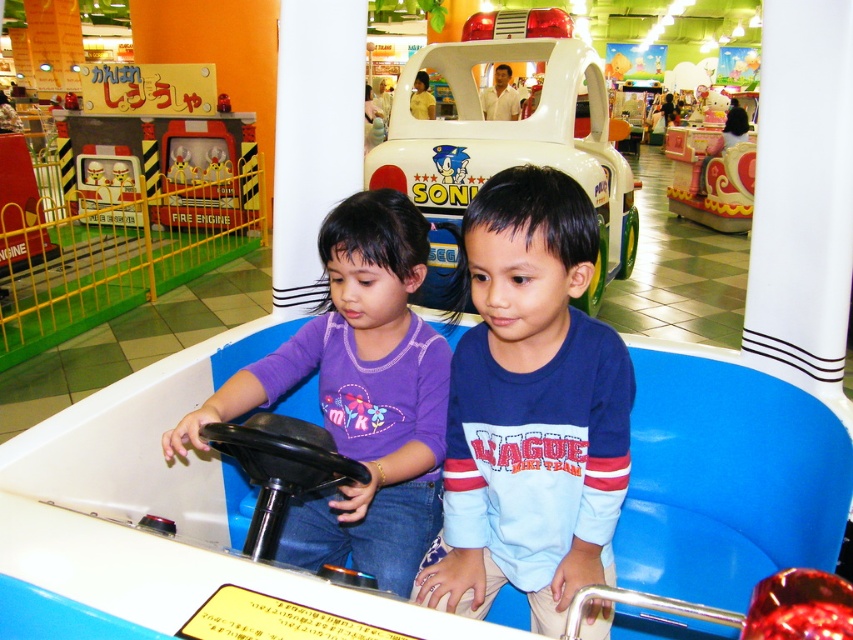
Question: Is metallic fire engine at upper left to the left of metallic yellow fire engine at left from the viewer's perspective?

Choices:
 (A) no
 (B) yes

Answer: (B)

Question: Among these objects, which one is nearest to the camera?

Choices:
 (A) purple matte shirt at center
 (B) metallic yellow fire engine at left

Answer: (A)

Question: Considering the real-world distances, which object is farthest from the metallic silver fire engine at center?

Choices:
 (A) white plastic toy car at center
 (B) metallic yellow fire engine at left
 (C) purple matte shirt at center

Answer: (C)

Question: Does purple matte shirt at center have a greater width compared to metallic yellow fire engine at left?

Choices:
 (A) no
 (B) yes

Answer: (A)

Question: Can you confirm if purple matte shirt at center is positioned to the right of metallic yellow fire engine at left?

Choices:
 (A) yes
 (B) no

Answer: (A)

Question: Based on their relative distances, which object is nearer to the metallic silver fire engine at center?

Choices:
 (A) metallic fire engine at upper left
 (B) purple matte shirt at center

Answer: (A)